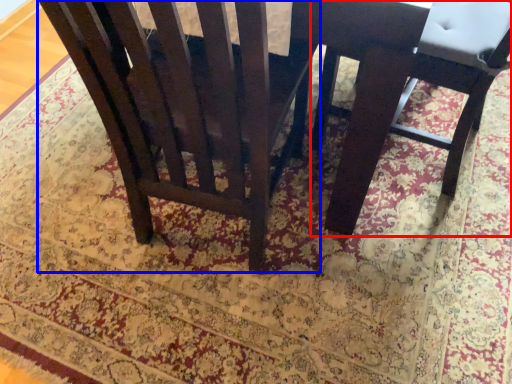
Question: Among these objects, which one is nearest to the camera, chair (highlighted by a red box) or chair (highlighted by a blue box)?

Choices:
 (A) chair
 (B) chair

Answer: (B)